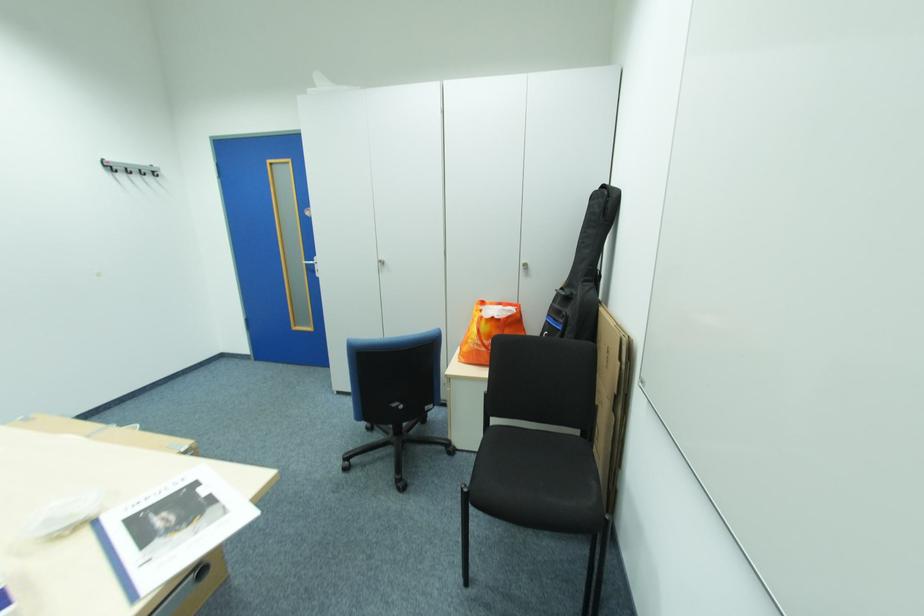
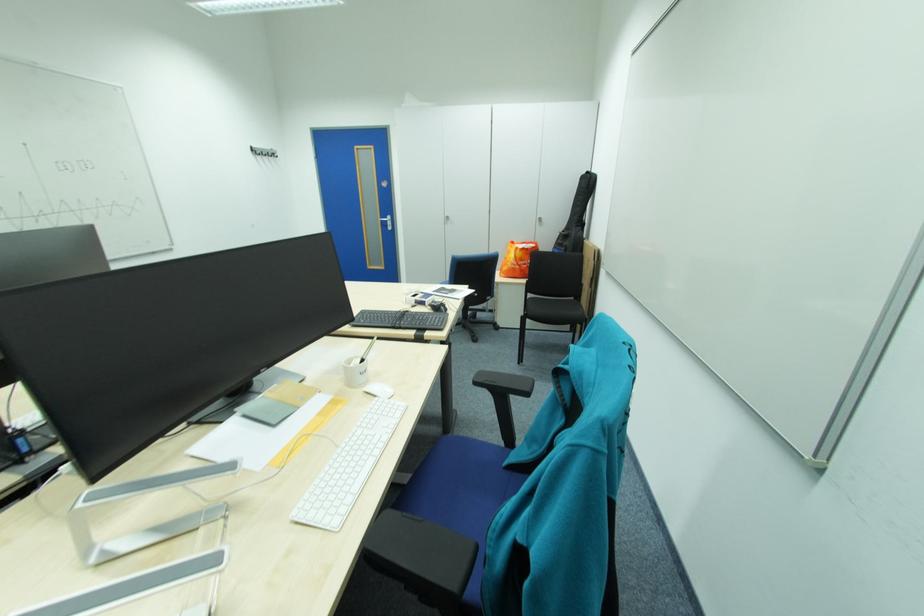
Find the pixel in the second image that matches pixel 480 345 in the first image.

(517, 265)